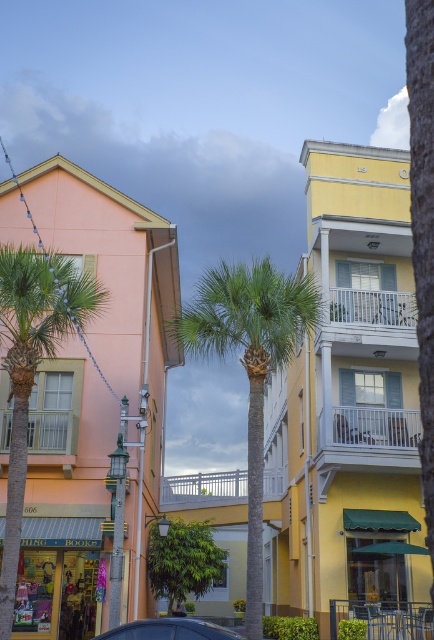
Question: Observing the image, what is the correct spatial positioning of green leafy palm tree at left in reference to blue glossy car at lower center?

Choices:
 (A) below
 (B) above

Answer: (A)

Question: Which point is farther to the camera?

Choices:
 (A) (36, 332)
 (B) (253, 378)
 (C) (115, 636)

Answer: (A)

Question: Which object appears farthest from the camera in this image?

Choices:
 (A) green leafy palm tree at left
 (B) green leafy palm tree at center
 (C) blue glossy car at lower center

Answer: (A)

Question: Is green leafy palm tree at left in front of blue glossy car at lower center?

Choices:
 (A) yes
 (B) no

Answer: (B)

Question: Is green leafy palm tree at left in front of blue glossy car at lower center?

Choices:
 (A) yes
 (B) no

Answer: (B)

Question: Which point is farther to the camera?

Choices:
 (A) (55, 268)
 (B) (174, 630)
 (C) (279, 323)

Answer: (A)